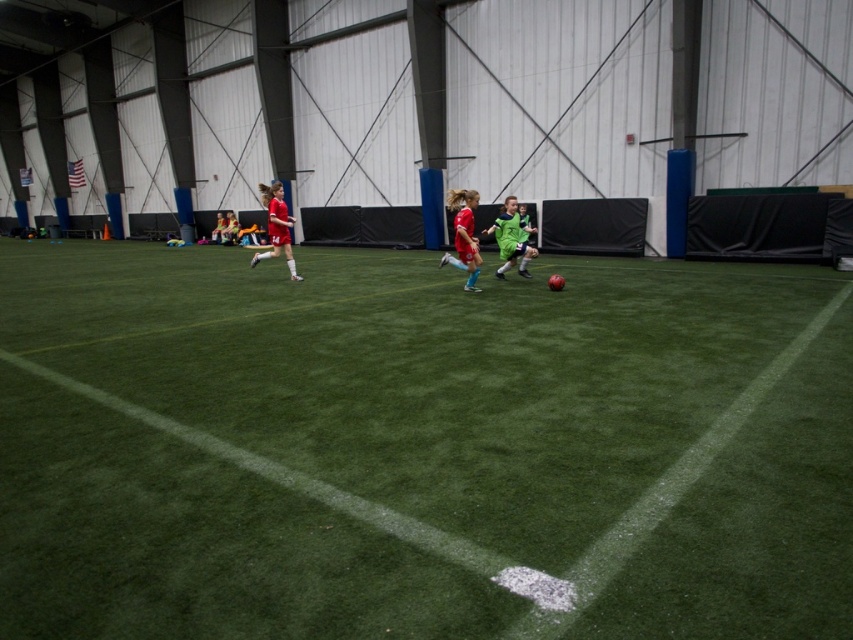
Is green artificial turf at center below matte red soccer jersey at center?

Yes, green artificial turf at center is below matte red soccer jersey at center.

In the scene shown: Who is more forward, (231, 412) or (281, 227)?

Point (231, 412)

Locate an element on the screen. The height and width of the screenshot is (640, 853). green artificial turf at center is located at coordinates (419, 445).

Is point (229, 566) closer to viewer compared to point (463, 289)?

Yes, it is.

Describe the element at coordinates (419, 445) in the screenshot. I see `green artificial turf at center` at that location.

Where is `green artificial turf at center`? Image resolution: width=853 pixels, height=640 pixels. green artificial turf at center is located at coordinates click(x=419, y=445).

Does green matte soccer player at center have a lesser width compared to matte red soccer jersey at center?

Yes, green matte soccer player at center is thinner than matte red soccer jersey at center.

Does green matte soccer player at center have a larger size compared to matte red soccer jersey at center?

Incorrect, green matte soccer player at center is not larger than matte red soccer jersey at center.

Which is in front, point (502, 244) or point (282, 234)?

Point (502, 244)

Locate an element on the screen. The image size is (853, 640). green matte soccer player at center is located at coordinates (511, 237).